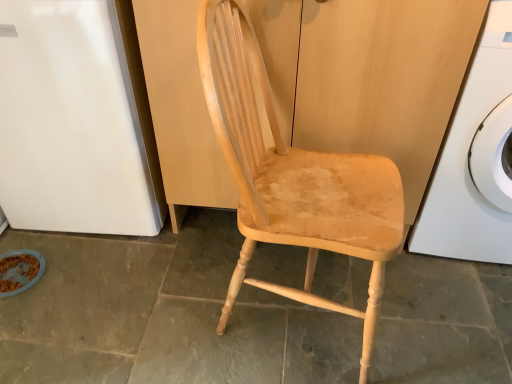
Identify the location of vacant space underneath natural wood chair at center (from a real-world perspective). (305, 321).